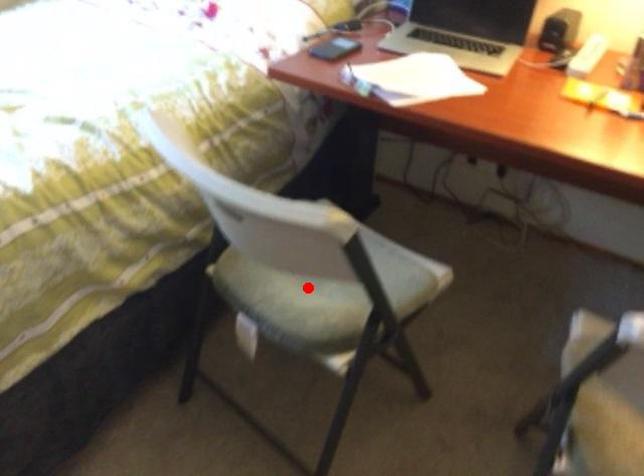
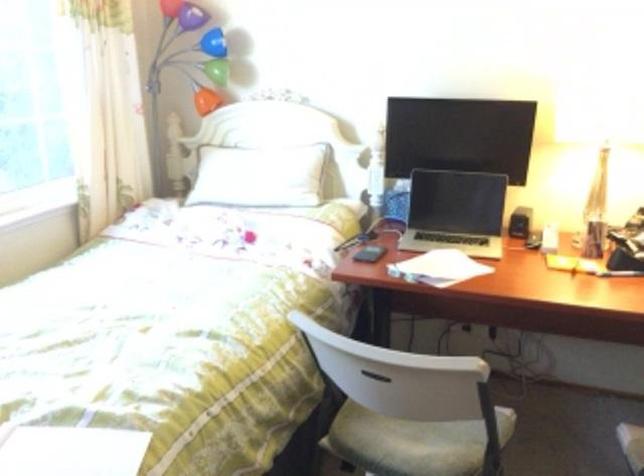
Question: I am providing you with two images of the same scene from different viewpoints. Image1 has a red point marked. In image2, the corresponding 3D location appears at what relative position? Reply with the corresponding letter.

Choices:
 (A) Closer
 (B) Farther

Answer: (B)